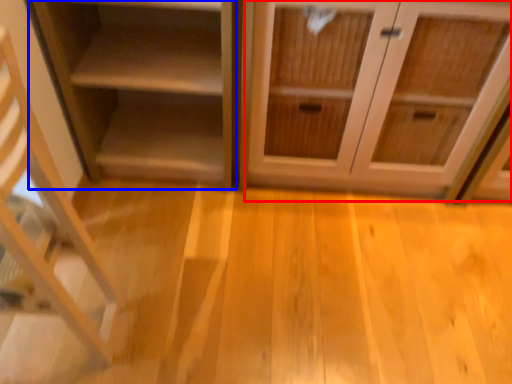
Question: Which object is closer to the camera taking this photo, cabinetry (highlighted by a red box) or shelf (highlighted by a blue box)?

Choices:
 (A) cabinetry
 (B) shelf

Answer: (A)